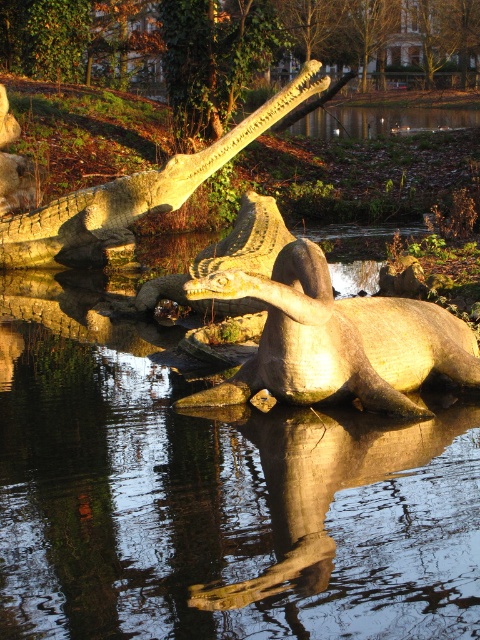
Question: Which of the following is the closest to the observer?

Choices:
 (A) green leafy tree at upper center
 (B) matte stone crocodile at upper center
 (C) matte stone crocodile at center

Answer: (C)

Question: Which point appears farthest from the camera in this image?

Choices:
 (A) (350, 307)
 (B) (0, 243)

Answer: (B)

Question: In this image, where is green leafy tree at upper center located relative to matte stone crocodile at center?

Choices:
 (A) above
 (B) below

Answer: (A)

Question: Where is green leafy tree at upper center located in relation to matte stone crocodile at upper center in the image?

Choices:
 (A) above
 (B) below

Answer: (A)

Question: Which is farther from the green leafy tree at upper center?

Choices:
 (A) matte stone crocodile at upper center
 (B) matte stone crocodile at center

Answer: (B)

Question: Can you confirm if green leafy tree at upper center is positioned above matte stone crocodile at center?

Choices:
 (A) yes
 (B) no

Answer: (A)